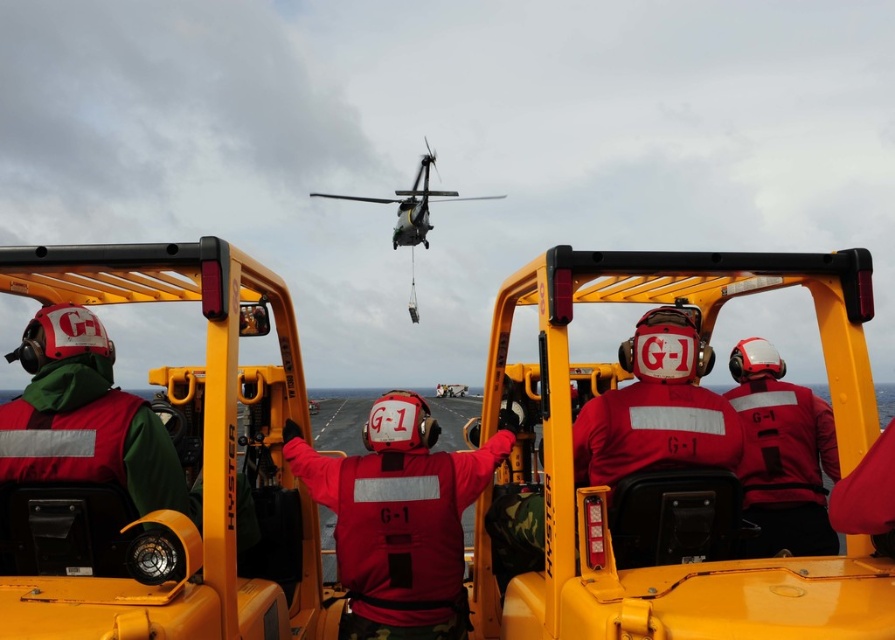
Consider the image. Is red matte helmet at center positioned in front of metallic gray helicopter at upper center?

That is True.

Who is more distant from viewer, [810,547] or [395,225]?

The point [395,225] is behind.

You are a GUI agent. You are given a task and a screenshot of the screen. Output one action in this format:
    pyautogui.click(x=<x>, y=<y>)
    Task: Click on the red matte helmet at center
    
    Given the screenshot: What is the action you would take?
    pyautogui.click(x=782, y=452)

Is the position of red matte jacket at center more distant than that of metallic gray helicopter at upper center?

No, red matte jacket at center is in front of metallic gray helicopter at upper center.

Does point (320, 460) come farther from viewer compared to point (411, 310)?

No, (320, 460) is in front of (411, 310).

Image resolution: width=895 pixels, height=640 pixels. What do you see at coordinates (399, 516) in the screenshot? I see `red matte jacket at center` at bounding box center [399, 516].

Where is `red matte jacket at center`? red matte jacket at center is located at coordinates (399, 516).

Who is positioned more to the left, red matte jacket at center or red matte helmet at center?

red matte jacket at center

Between red matte jacket at center and red matte helmet at center, which one has less height?

With less height is red matte jacket at center.

What do you see at coordinates (399, 516) in the screenshot? I see `red matte jacket at center` at bounding box center [399, 516].

Where is `red matte jacket at center`? This screenshot has height=640, width=895. red matte jacket at center is located at coordinates (399, 516).